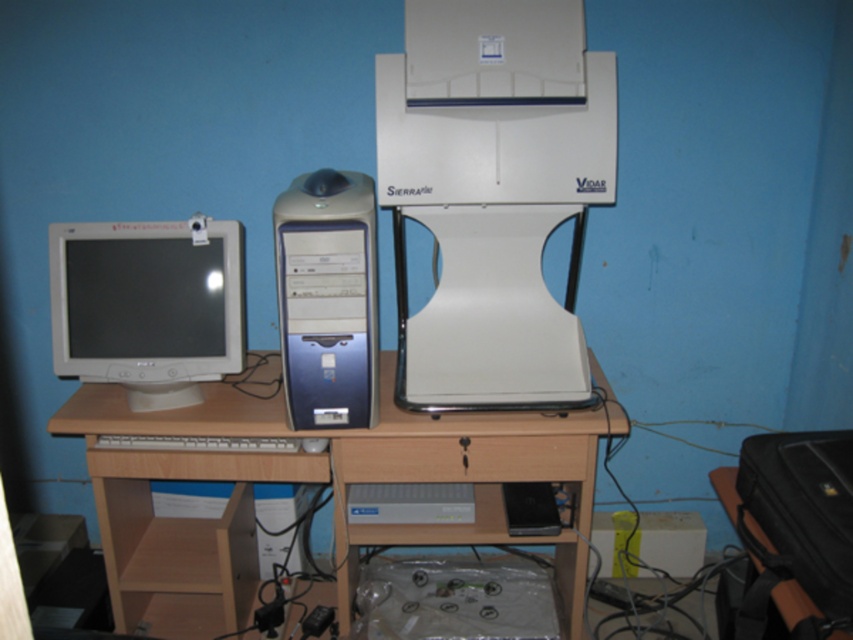
Is point (436, 449) positioned behind point (733, 467)?

No, it is not.

Where is `wooden drawer at center`? The image size is (853, 640). wooden drawer at center is located at coordinates (462, 458).

Who is lower down, wooden at center or white plastic keyboard at center?

wooden at center is below.

Is wooden at center above white plastic keyboard at center?

Actually, wooden at center is below white plastic keyboard at center.

Is point (190, 524) behind point (103, 435)?

Yes, point (190, 524) is behind point (103, 435).

Where is `wooden at center`? The image size is (853, 640). wooden at center is located at coordinates (318, 481).

Which of these two, wooden at center or matte white monitor at left, stands shorter?

matte white monitor at left is shorter.

Can you confirm if wooden at center is taller than matte white monitor at left?

Yes, wooden at center is taller than matte white monitor at left.

Between point (230, 605) and point (125, 365), which one is positioned behind?

Positioned behind is point (230, 605).

Where is `wooden at center`? The image size is (853, 640). wooden at center is located at coordinates (318, 481).